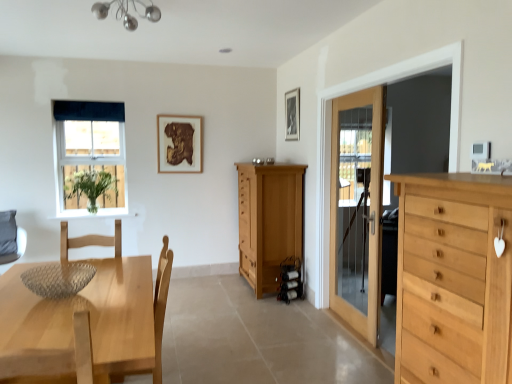
Question: Is point (163, 258) positioned closer to the camera than point (293, 119)?

Choices:
 (A) farther
 (B) closer

Answer: (B)

Question: From the image's perspective, relative to black matte picture frame at upper center, placed as the 1th picture frame when sorted from right to left, is light wood chair at lower left above or below?

Choices:
 (A) above
 (B) below

Answer: (B)

Question: Which is farther from the light wood chair at lower left?

Choices:
 (A) green matte vase at left
 (B) dark blue fabric at upper left
 (C) wooden frame at upper center, which appears as the second picture frame when viewed from the right
 (D) light wood chest of drawers at right, acting as the 1th chest of drawers starting from the right
 (E) black matte picture frame at upper center, the second picture frame viewed from the back

Answer: (A)

Question: Estimate the real-world distances between objects in this image. Which object is closer to the metallic glass chandelier at upper center?

Choices:
 (A) light brown wooden door at right
 (B) gray fabric swivel chair at lower left
 (C) black matte picture frame at upper center, the second picture frame viewed from the back
 (D) green matte vase at left
 (E) matte glass window at upper left

Answer: (C)